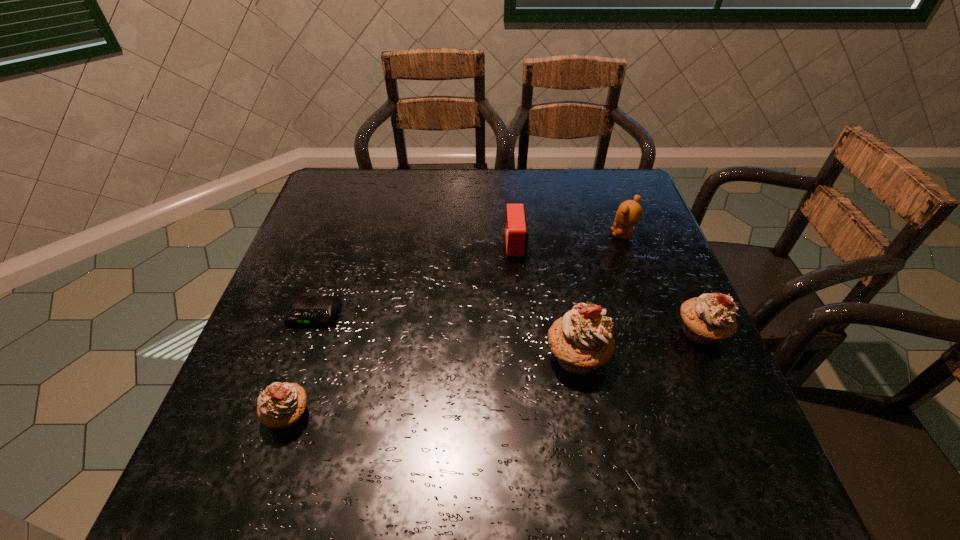
Where is `free location located 0.130m on the display of the shortest object`? This screenshot has width=960, height=540. free location located 0.130m on the display of the shortest object is located at coordinates (291, 381).

Find the location of a particular element. Image resolution: width=960 pixels, height=540 pixels. object that is at the near edge is located at coordinates (281, 405).

This screenshot has height=540, width=960. In order to click on cupcake located in the left edge section of the desktop in this screenshot , I will do `click(281, 405)`.

This screenshot has width=960, height=540. In order to click on alarm clock that is at the left edge in this screenshot , I will do `click(303, 310)`.

Identify the location of cupcake that is at the right edge. This screenshot has width=960, height=540. (709, 318).

The height and width of the screenshot is (540, 960). Identify the location of teddy bear that is at the right edge. (629, 213).

The image size is (960, 540). Find the location of `object that is at the near left corner`. object that is at the near left corner is located at coordinates (281, 405).

Locate an element on the screen. The height and width of the screenshot is (540, 960). vacant space at the far edge is located at coordinates (447, 212).

The width and height of the screenshot is (960, 540). I want to click on free location at the near edge, so click(465, 426).

You are a GUI agent. You are given a task and a screenshot of the screen. Output one action in this format:
    pyautogui.click(x=<x>, y=<y>)
    Task: Click on the vacant area at the left edge
    Image resolution: width=960 pixels, height=540 pixels.
    Given the screenshot: What is the action you would take?
    pyautogui.click(x=291, y=329)